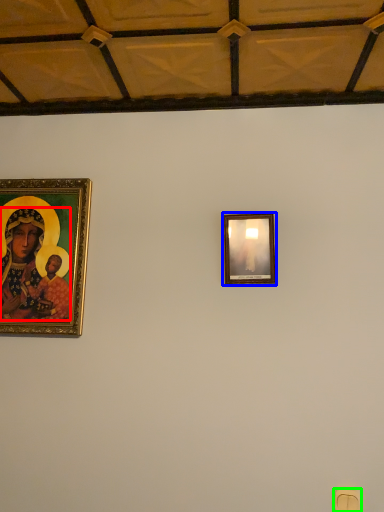
Question: Which is nearer to the person (highlighted by a red box)? picture frame (highlighted by a blue box) or light switch (highlighted by a green box).

Choices:
 (A) picture frame
 (B) light switch

Answer: (A)